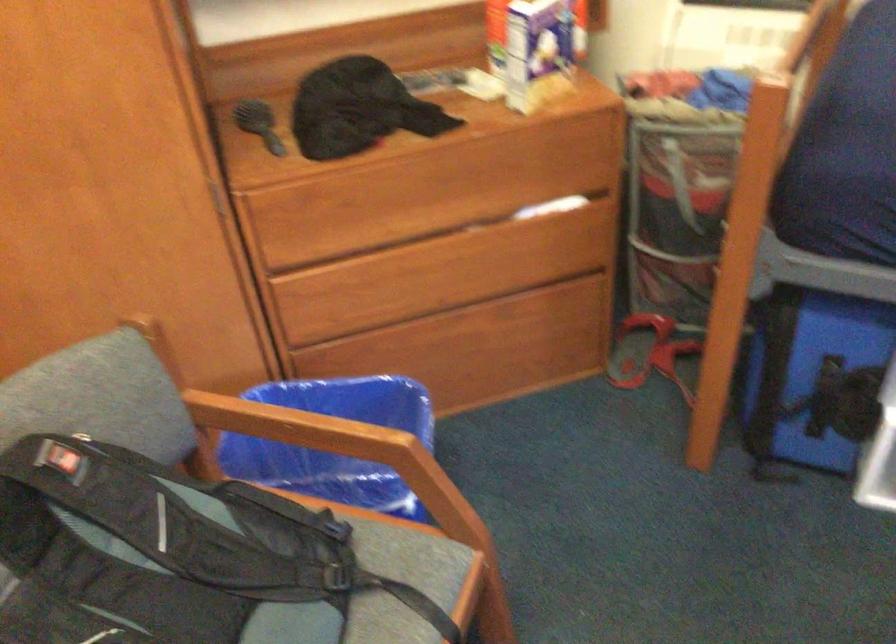
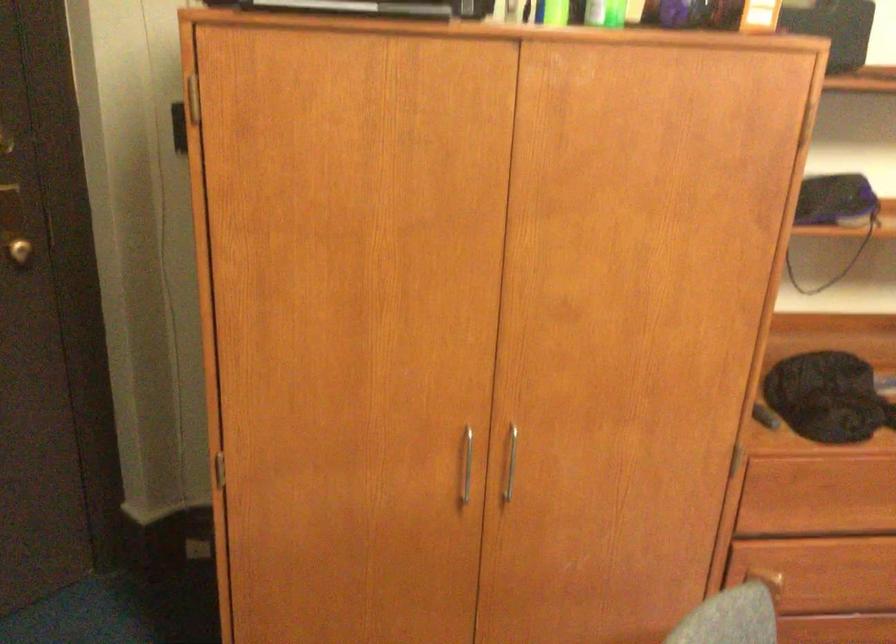
Question: The images are taken continuously from a first-person perspective. In which direction are you moving?

Choices:
 (A) Left
 (B) Right
 (C) Forward
 (D) Backward

Answer: (A)